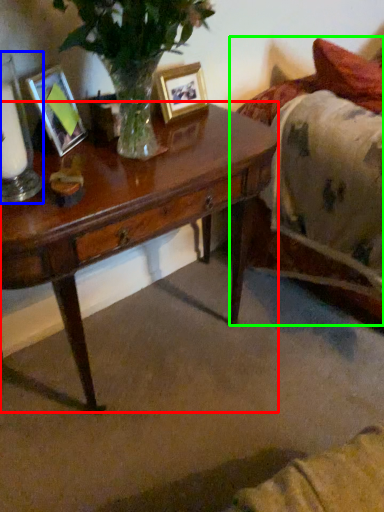
Question: Based on their relative distances, which object is nearer to desk (highlighted by a red box)? Choose from candle holder (highlighted by a blue box) and bed (highlighted by a green box).

Choices:
 (A) candle holder
 (B) bed

Answer: (A)